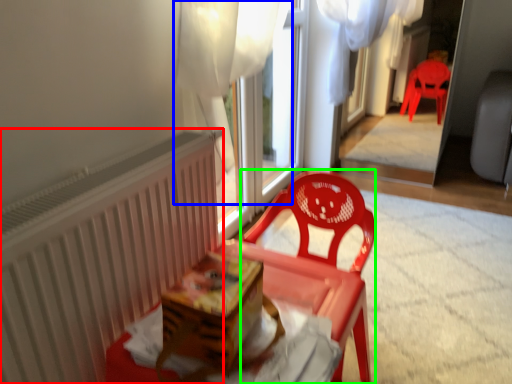
Question: Estimate the real-world distances between objects in this image. Which object is farther from radiator (highlighted by a red box), curtain (highlighted by a blue box) or chair (highlighted by a green box)?

Choices:
 (A) curtain
 (B) chair

Answer: (A)